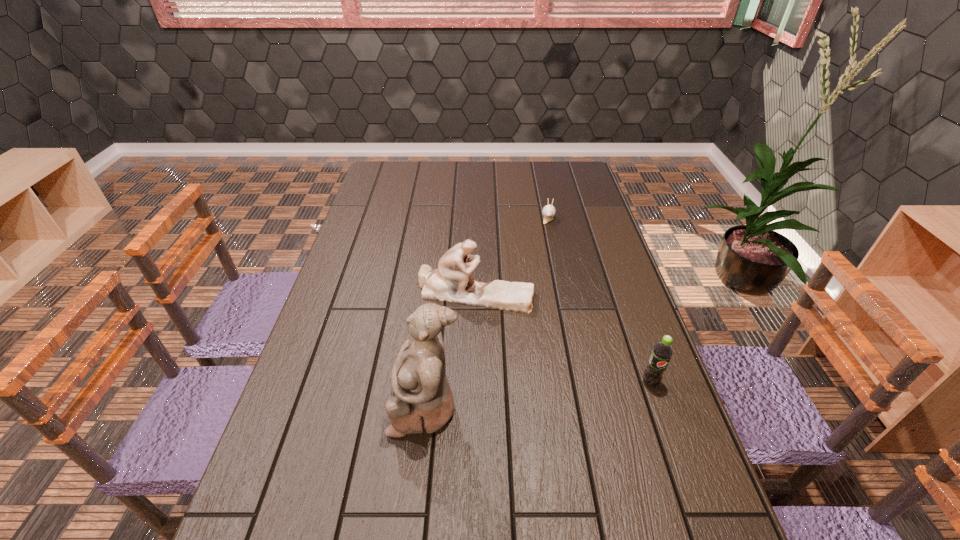
This screenshot has width=960, height=540. In order to click on free space at the left edge of the desktop in this screenshot , I will do `click(300, 407)`.

The width and height of the screenshot is (960, 540). Find the location of `free region at the right edge of the desktop`. free region at the right edge of the desktop is located at coordinates (633, 417).

The height and width of the screenshot is (540, 960). In the image, there is a desktop. What are the coordinates of `free region at the far left corner` in the screenshot? It's located at (388, 174).

Find the location of a particular element. vacant space at the near left corner of the desktop is located at coordinates (303, 492).

Where is `vacant point located between the tallest object and the shorter figurine`? This screenshot has height=540, width=960. vacant point located between the tallest object and the shorter figurine is located at coordinates point(450,350).

Find the location of a particular element. This screenshot has width=960, height=540. vacant space in between the tallest object and the rightmost object is located at coordinates (538, 395).

Image resolution: width=960 pixels, height=540 pixels. I want to click on vacant space that is in between the tallest object and the third nearest object, so click(x=450, y=350).

Where is `free space between the escargot and the taller figurine`? The height and width of the screenshot is (540, 960). free space between the escargot and the taller figurine is located at coordinates (487, 311).

The width and height of the screenshot is (960, 540). Identify the location of vacant area that lies between the rightmost object and the shorter figurine. (563, 338).

Where is `vacant point located between the tallest object and the rightmost object`? The width and height of the screenshot is (960, 540). vacant point located between the tallest object and the rightmost object is located at coordinates (538, 395).